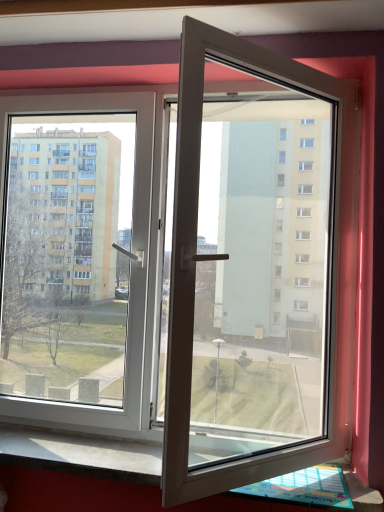
Question: From a real-world perspective, is black granite window sill at lower center below white plastic door at center?

Choices:
 (A) yes
 (B) no

Answer: (A)

Question: Considering the relative positions of black granite window sill at lower center and white plastic door at center in the image provided, is black granite window sill at lower center to the left of white plastic door at center from the viewer's perspective?

Choices:
 (A) no
 (B) yes

Answer: (A)

Question: Could you tell me if black granite window sill at lower center is facing white plastic door at center?

Choices:
 (A) yes
 (B) no

Answer: (B)

Question: From the image's perspective, is black granite window sill at lower center located above white plastic door at center?

Choices:
 (A) yes
 (B) no

Answer: (B)

Question: Is black granite window sill at lower center not near white plastic door at center?

Choices:
 (A) yes
 (B) no

Answer: (B)

Question: Is the depth of black granite window sill at lower center less than that of white plastic door at center?

Choices:
 (A) no
 (B) yes

Answer: (A)

Question: Is the depth of white plastic door at center greater than that of black granite window sill at lower center?

Choices:
 (A) yes
 (B) no

Answer: (B)

Question: Is there a large distance between white plastic door at center and black granite window sill at lower center?

Choices:
 (A) yes
 (B) no

Answer: (B)

Question: Can you confirm if white plastic door at center is wider than black granite window sill at lower center?

Choices:
 (A) no
 (B) yes

Answer: (B)

Question: Is white plastic door at center taller than black granite window sill at lower center?

Choices:
 (A) yes
 (B) no

Answer: (A)

Question: From the image's perspective, is white plastic door at center on top of black granite window sill at lower center?

Choices:
 (A) yes
 (B) no

Answer: (A)

Question: Can you confirm if white plastic door at center is bigger than black granite window sill at lower center?

Choices:
 (A) no
 (B) yes

Answer: (B)

Question: Does point (297, 416) appear closer or farther from the camera than point (367, 486)?

Choices:
 (A) farther
 (B) closer

Answer: (A)